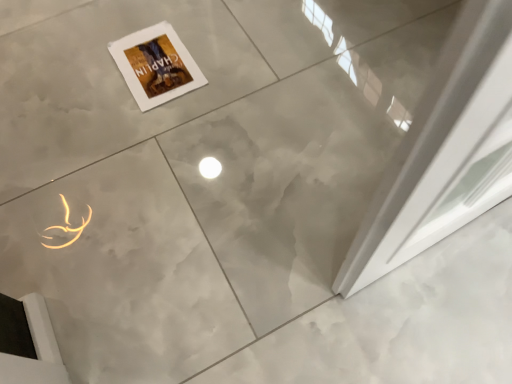
What do you see at coordinates (156, 65) in the screenshot? I see `white paper at upper left` at bounding box center [156, 65].

Where is `white paper at upper left`? Image resolution: width=512 pixels, height=384 pixels. white paper at upper left is located at coordinates (156, 65).

Locate an element on the screen. white paper at upper left is located at coordinates (156, 65).